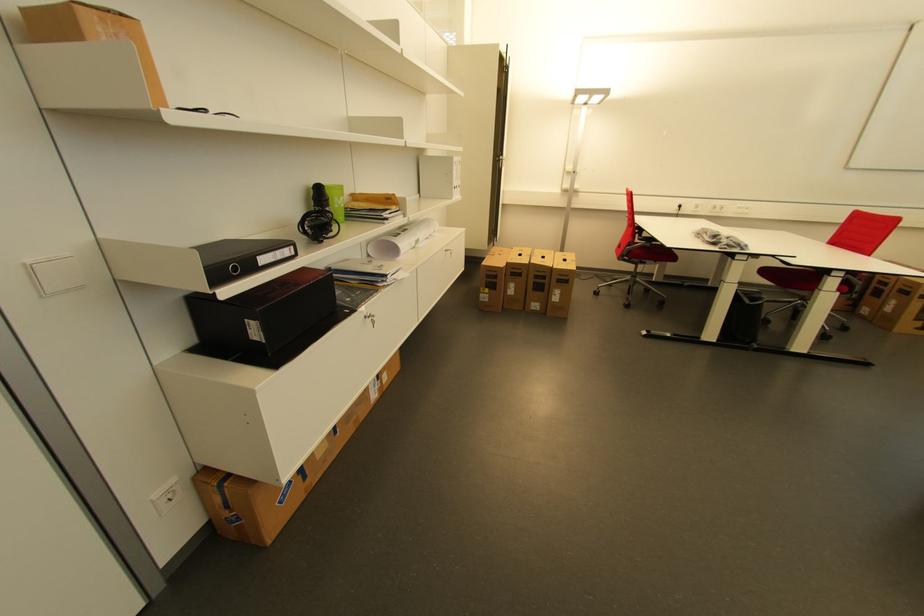
Describe the element at coordinates (166, 496) in the screenshot. The width and height of the screenshot is (924, 616). I see `the white light switch` at that location.